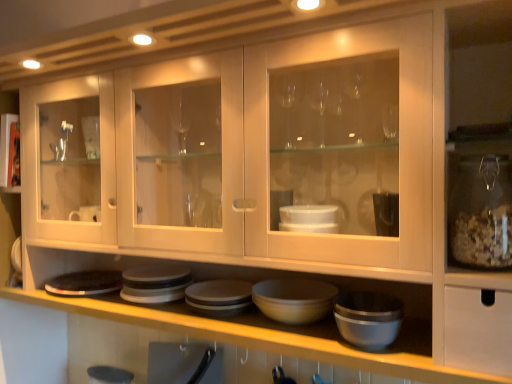
Find the location of `free point above matte gray platter at lower center (from a real-world perspective)`. free point above matte gray platter at lower center (from a real-world perspective) is located at coordinates (90, 279).